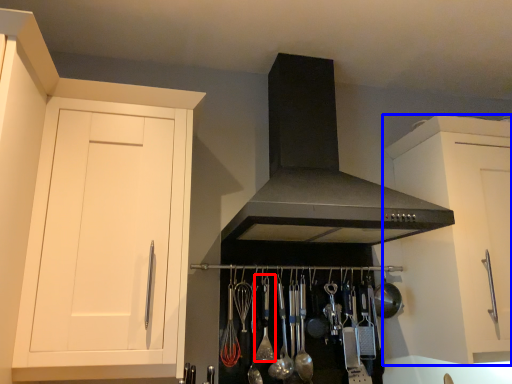
Question: Which point is further to the camera, utensil (highlighted by a red box) or cabinetry (highlighted by a blue box)?

Choices:
 (A) utensil
 (B) cabinetry

Answer: (A)